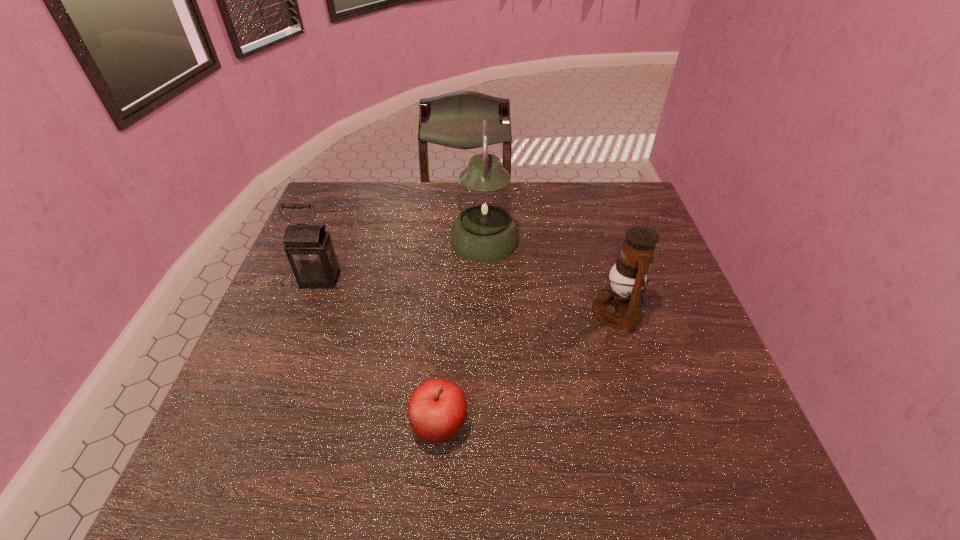
In the image, there is a desktop. Find the location of `vacant space at the left edge`. vacant space at the left edge is located at coordinates (328, 297).

This screenshot has width=960, height=540. Identify the location of free location at the right edge. (689, 386).

Locate an element on the screen. The width and height of the screenshot is (960, 540). vacant region at the far left corner of the desktop is located at coordinates (372, 192).

You are a GUI agent. You are given a task and a screenshot of the screen. Output one action in this format:
    pyautogui.click(x=<x>, y=<y>)
    Task: Click on the vacant space at the far right corner of the desktop
    The width and height of the screenshot is (960, 540).
    Given the screenshot: What is the action you would take?
    pyautogui.click(x=599, y=205)

Where is `vacant point located between the rightmost object and the apple`? The height and width of the screenshot is (540, 960). vacant point located between the rightmost object and the apple is located at coordinates (528, 368).

Identify the location of free point between the rightmost lantern and the third tallest object. Image resolution: width=960 pixels, height=540 pixels. (468, 295).

Find the location of a particular element. This screenshot has width=960, height=540. free space between the second shortest object and the shortest object is located at coordinates (380, 353).

Where is `vacant space that is in between the leftmost object and the nearest object`? The width and height of the screenshot is (960, 540). vacant space that is in between the leftmost object and the nearest object is located at coordinates (380, 353).

Where is `blank region between the farthest lantern and the shortest lantern`? blank region between the farthest lantern and the shortest lantern is located at coordinates (402, 260).

This screenshot has height=540, width=960. Find the location of `free point between the tallest lantern and the apple`. free point between the tallest lantern and the apple is located at coordinates (462, 333).